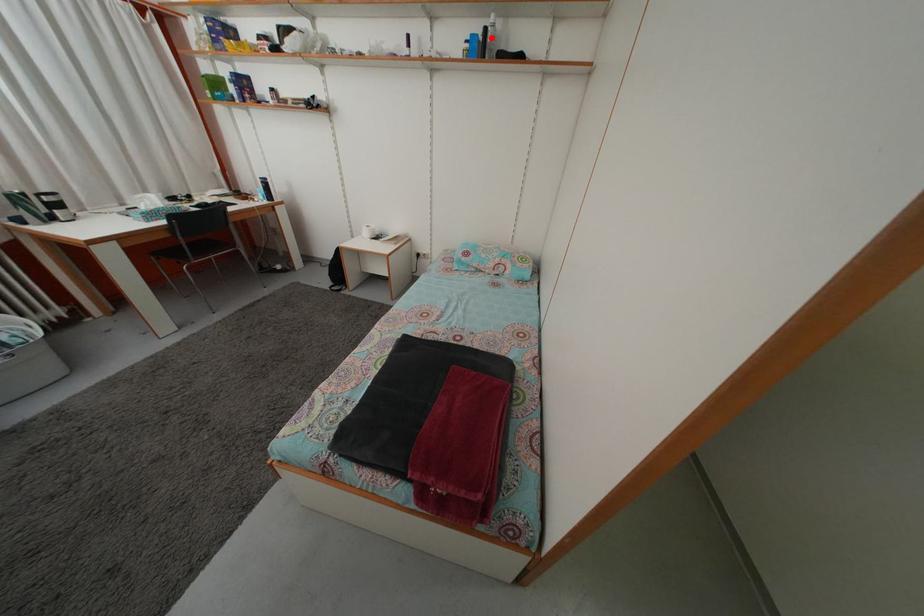
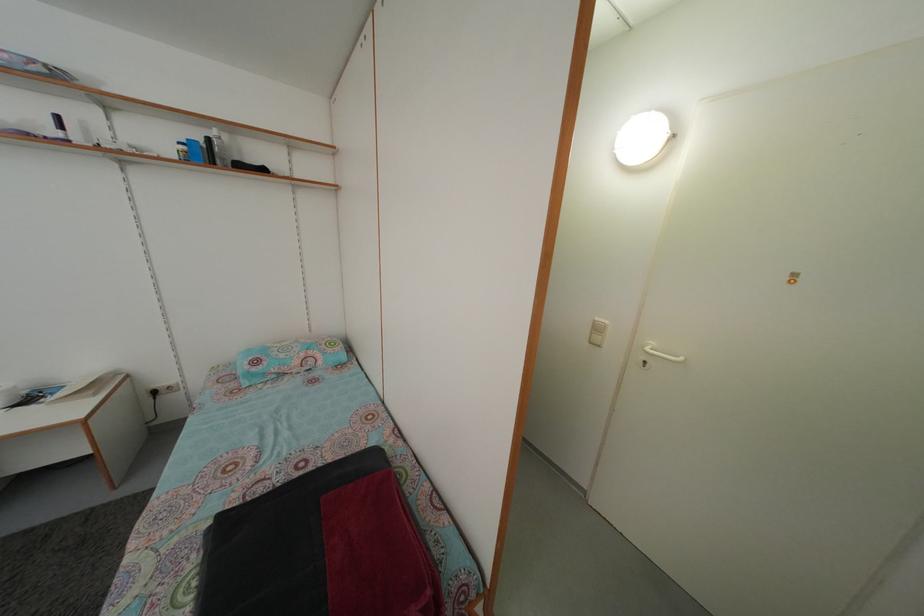
Where in the second image is the point corresponding to the highlighted location from the first image?

(214, 148)